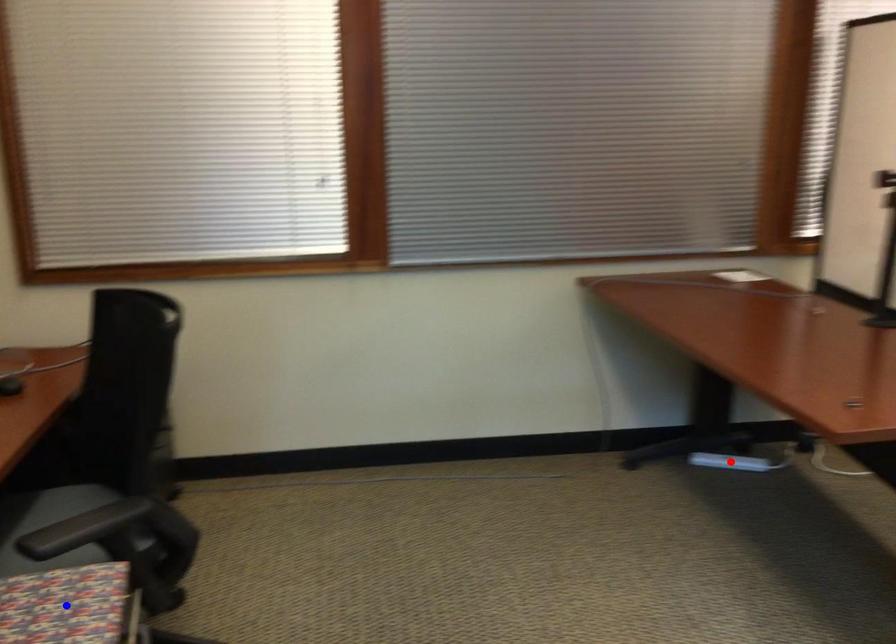
Question: In the image, two points are highlighted. Which point is nearer to the camera? Reply with the corresponding letter.

Choices:
 (A) blue point
 (B) red point

Answer: (A)